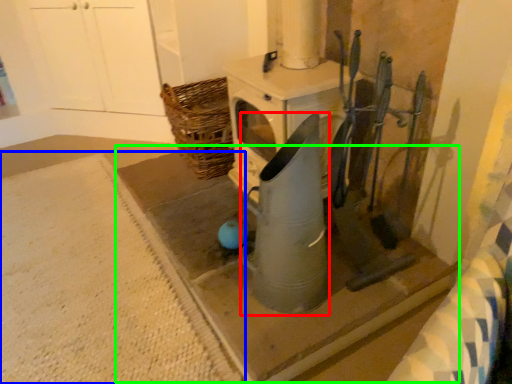
Question: Which object is positioned closest to appliance (highlighted by a red box)? Select from concrete (highlighted by a blue box) and concrete (highlighted by a green box).

Choices:
 (A) concrete
 (B) concrete

Answer: (B)